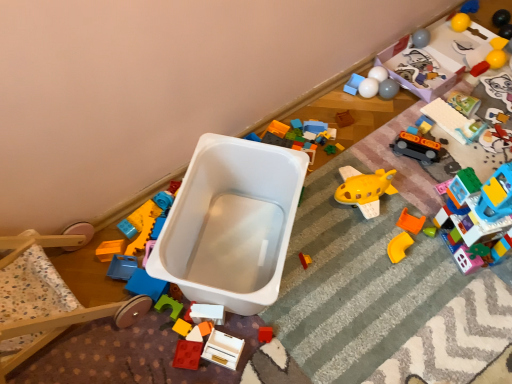
Image resolution: width=512 pixels, height=384 pixels. In order to click on vacant space to the left of rubberized red brick at lower center, the 2th toy viewed from the left in this screenshot , I will do `click(131, 352)`.